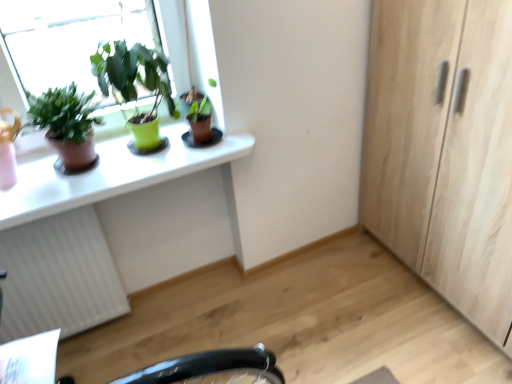
This screenshot has width=512, height=384. Find the location of `unoccupied region to the right of white textured radiator at lower left`. unoccupied region to the right of white textured radiator at lower left is located at coordinates (144, 332).